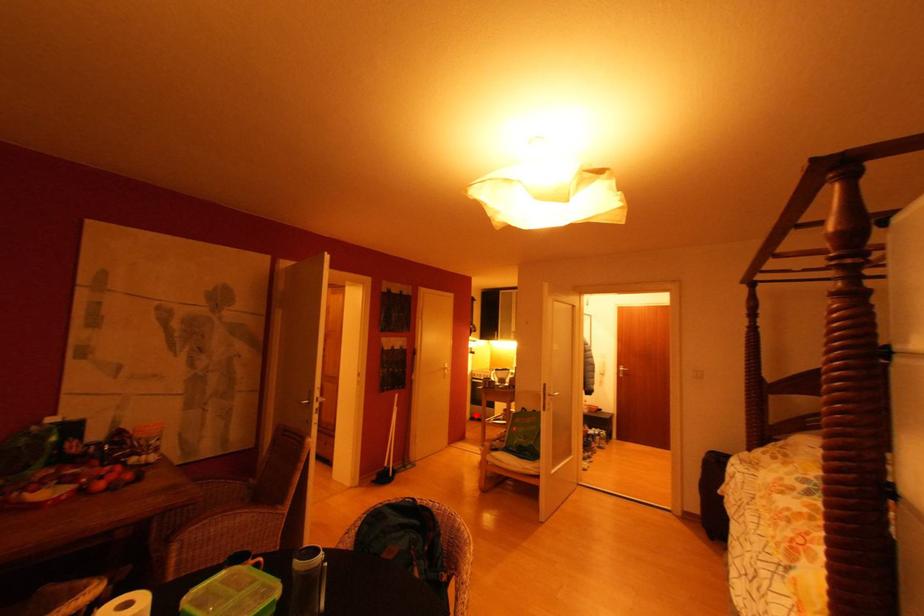
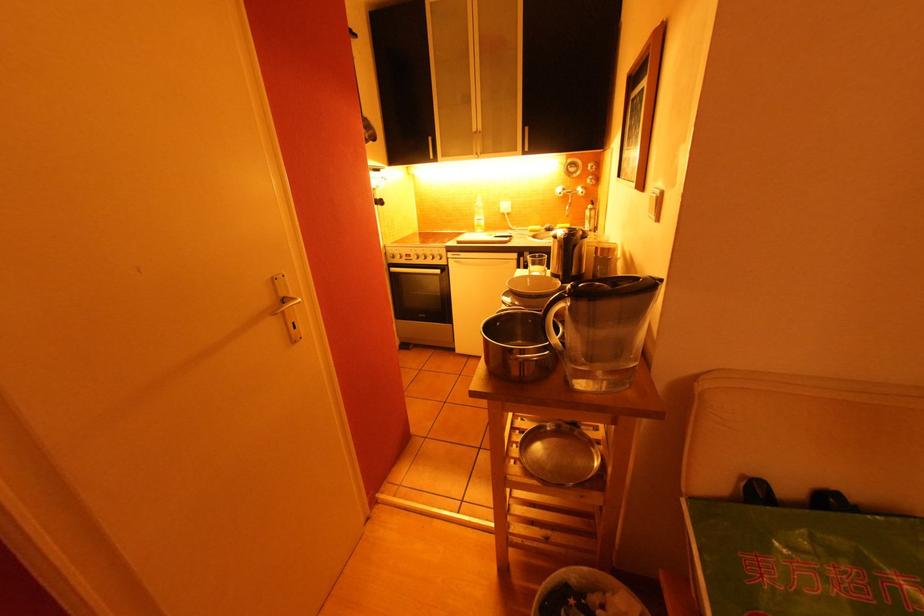
In the second image, find the point that corresponds to the highlighted location in the first image.

(405, 339)